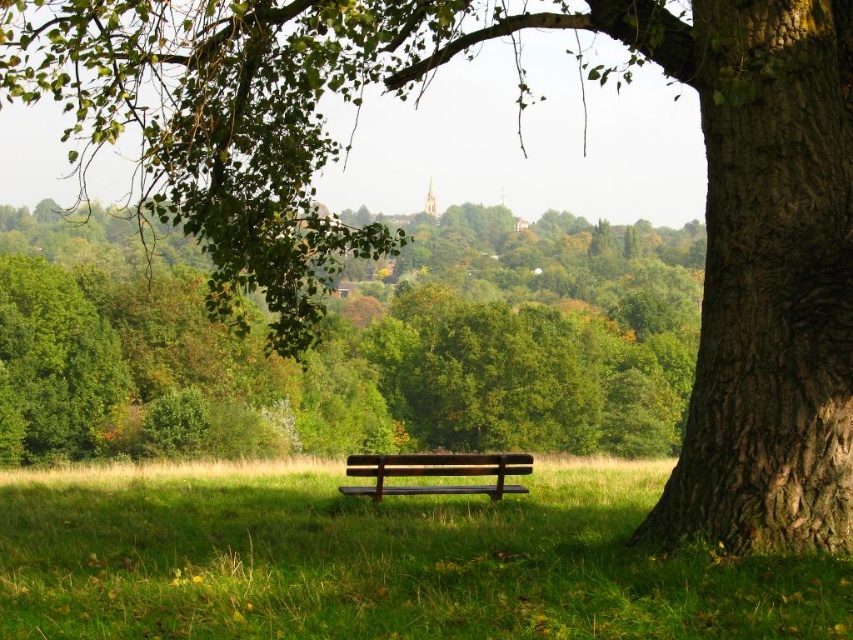
Is green grassy at center positioned at the back of brown wooden bench at center?

No, green grassy at center is closer to the viewer.

Which is above, green grassy at center or brown wooden bench at center?

green grassy at center

Find the location of a particular element. The width and height of the screenshot is (853, 640). green grassy at center is located at coordinates (376, 561).

At what (x,y) coordinates should I click in order to perform the action: click on green grassy at center. Please return your answer as a coordinate pair (x, y). This screenshot has height=640, width=853. Looking at the image, I should click on (376, 561).

Is brown rough bark tree at lower right further to camera compared to green grassy at center?

Yes.

Is brown rough bark tree at lower right positioned before green grassy at center?

No, brown rough bark tree at lower right is behind green grassy at center.

Measure the distance between brown rough bark tree at lower right and camera.

A distance of 13.81 meters exists between brown rough bark tree at lower right and camera.

You are a GUI agent. You are given a task and a screenshot of the screen. Output one action in this format:
    pyautogui.click(x=<x>, y=<y>)
    Task: Click on the brown rough bark tree at lower right
    
    Given the screenshot: What is the action you would take?
    pyautogui.click(x=351, y=342)

Is the position of brown rough bark tree at lower right more distant than that of brown wooden bench at center?

Yes, brown rough bark tree at lower right is further from the viewer.

You are a GUI agent. You are given a task and a screenshot of the screen. Output one action in this format:
    pyautogui.click(x=<x>, y=<y>)
    Task: Click on the brown rough bark tree at lower right
    Image resolution: width=853 pixels, height=640 pixels.
    Given the screenshot: What is the action you would take?
    pyautogui.click(x=351, y=342)